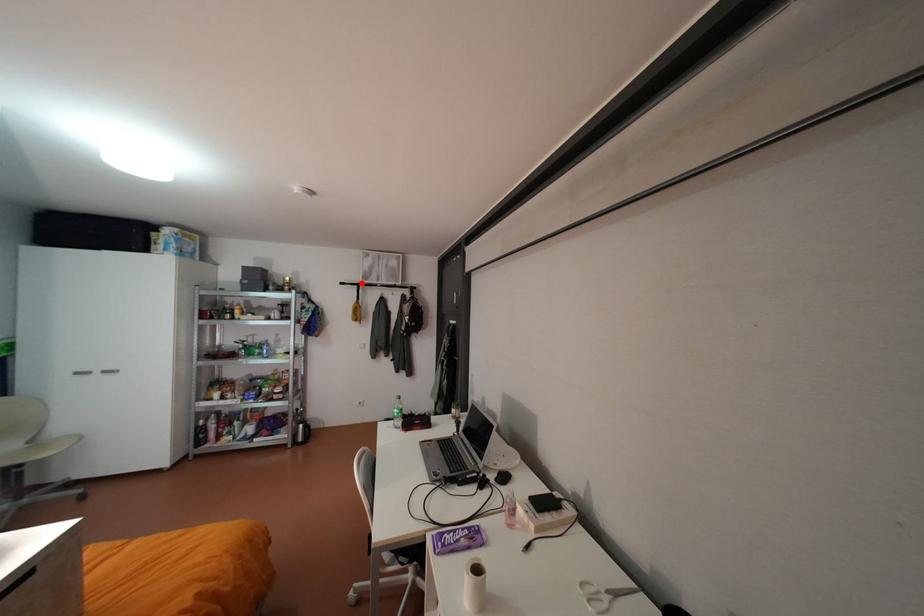
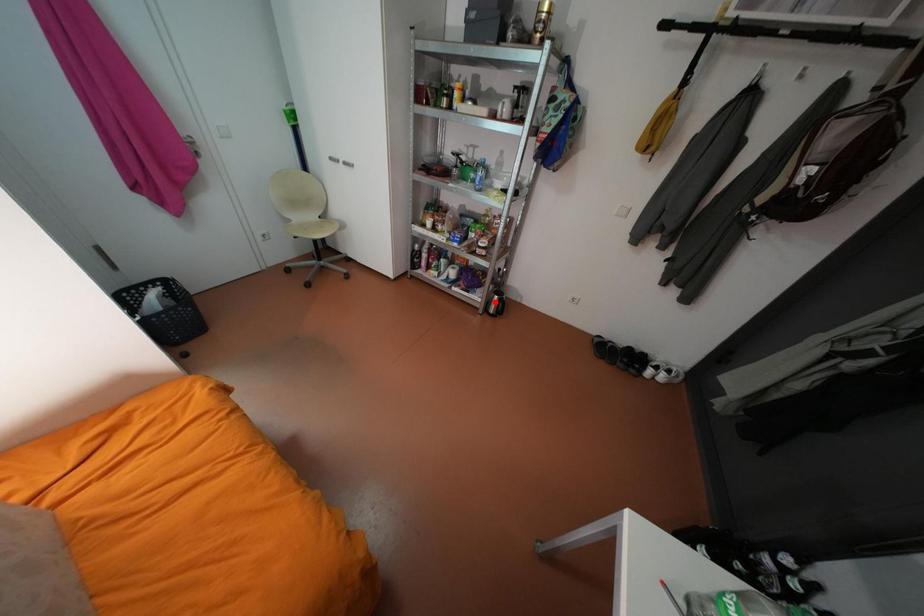
I am providing you with two images of the same scene from different viewpoints. A red point is marked on the first image and another point is marked on the second image. Do the highlighted points in image1 and image2 indicate the same real-world spot?

No